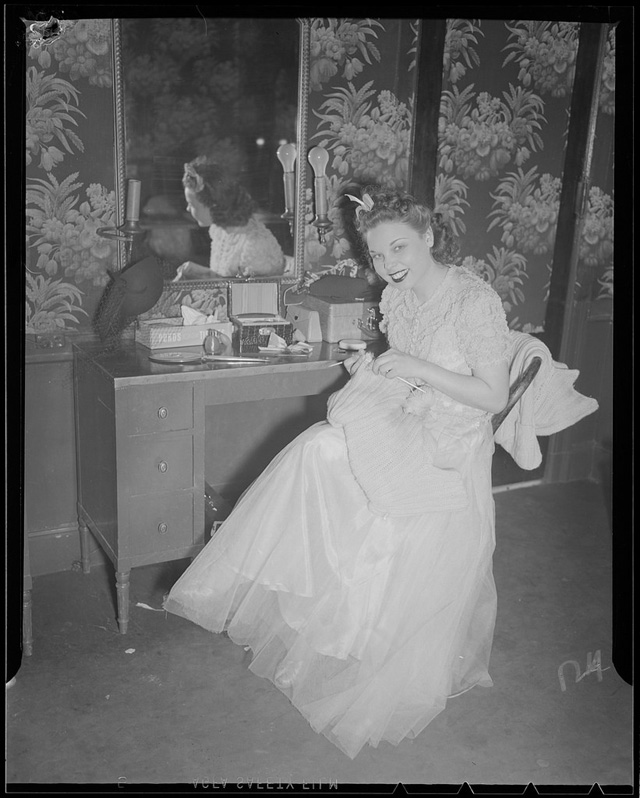
Where is `light bulb`? light bulb is located at coordinates (315, 162).